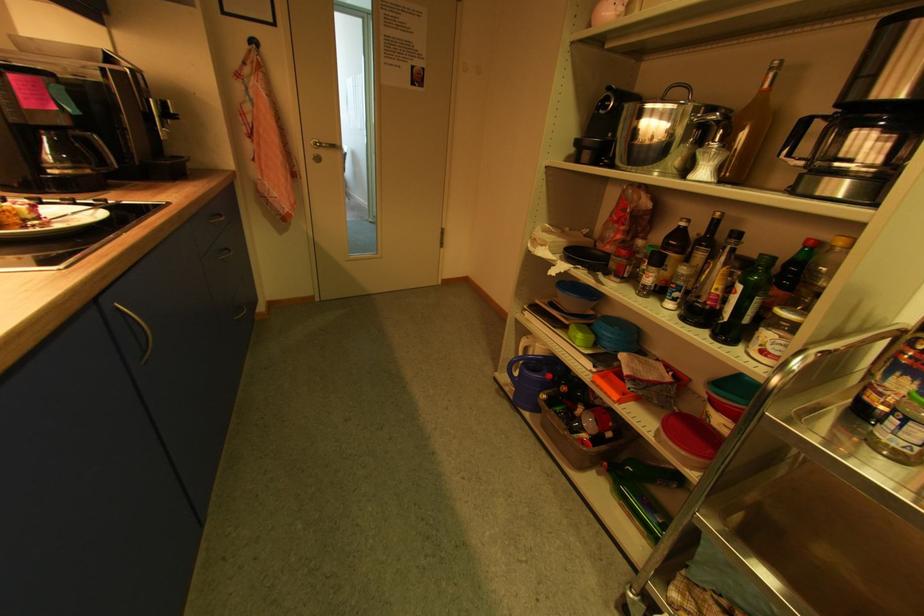
Where is `dark wine bottle`? The width and height of the screenshot is (924, 616). dark wine bottle is located at coordinates (703, 253).